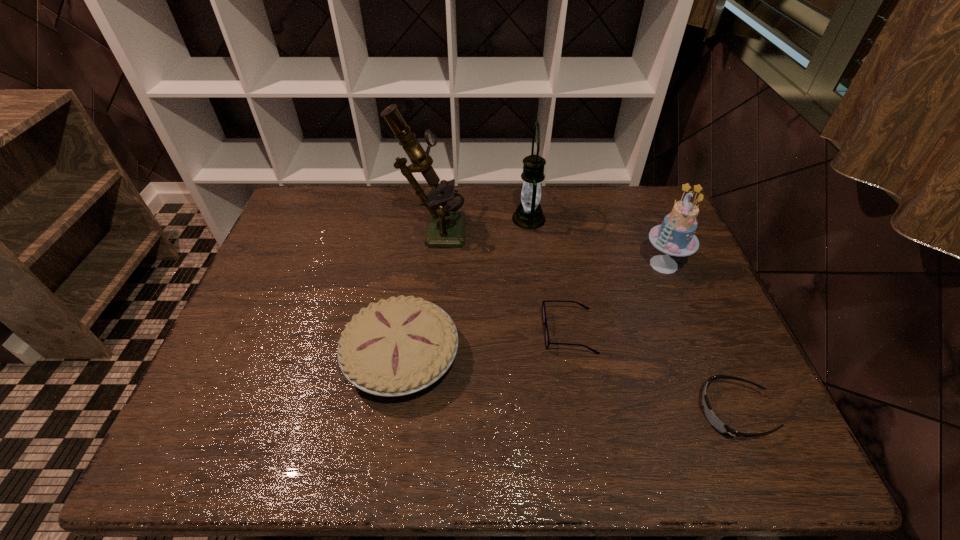
Identify the location of the tallest object. (445, 227).

Locate an element on the screen. The height and width of the screenshot is (540, 960). the fifth shortest object is located at coordinates (528, 215).

This screenshot has width=960, height=540. I want to click on cake, so click(x=675, y=236).

Where is `the third shortest object`? the third shortest object is located at coordinates (395, 347).

Locate an element on the screen. This screenshot has width=960, height=540. spectacles is located at coordinates (547, 341).

The height and width of the screenshot is (540, 960). I want to click on sunglasses, so click(x=722, y=428).

You are a GUI agent. You are given a task and a screenshot of the screen. Output one action in this format:
    pyautogui.click(x=<x>, y=<y>)
    Task: Click on the free space located 0.210m at the eyepiece of the microscope
    
    Given the screenshot: What is the action you would take?
    pyautogui.click(x=530, y=227)

Find the location of a particular element. vacant region located on the side where the second tallest object emits light is located at coordinates (437, 219).

At what (x,y) coordinates should I click in order to perform the action: click on vacant area situated 0.110m on the side where the second tallest object emits light. Please return your answer as a coordinate pair (x, y). The width and height of the screenshot is (960, 540). Looking at the image, I should click on (479, 219).

Locate an element on the screen. free spot located 0.310m on the side where the second tallest object emits light is located at coordinates (419, 219).